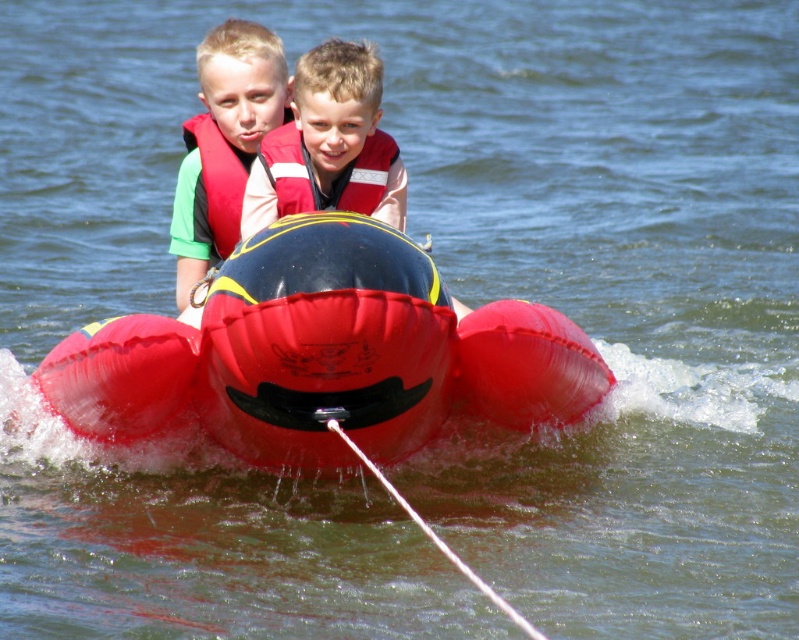
Question: Which object appears closest to the camera in this image?

Choices:
 (A) red nylon life jacket at upper center
 (B) matte red life vest at center

Answer: (B)

Question: Does rubberized red inflatable boat at center have a larger size compared to red nylon life jacket at upper center?

Choices:
 (A) no
 (B) yes

Answer: (A)

Question: Among these points, which one is farthest from the camera?

Choices:
 (A) (261, 148)
 (B) (205, 198)

Answer: (B)

Question: Which object appears farthest from the camera in this image?

Choices:
 (A) rubberized red inflatable boat at center
 (B) matte red life vest at upper center
 (C) red matte life jacket at center
 (D) matte red life vest at center

Answer: (B)

Question: Does matte red life vest at upper center come behind red matte life jacket at center?

Choices:
 (A) no
 (B) yes

Answer: (B)

Question: In this image, where is matte red life vest at upper center located relative to red matte life jacket at center?

Choices:
 (A) below
 (B) above

Answer: (B)